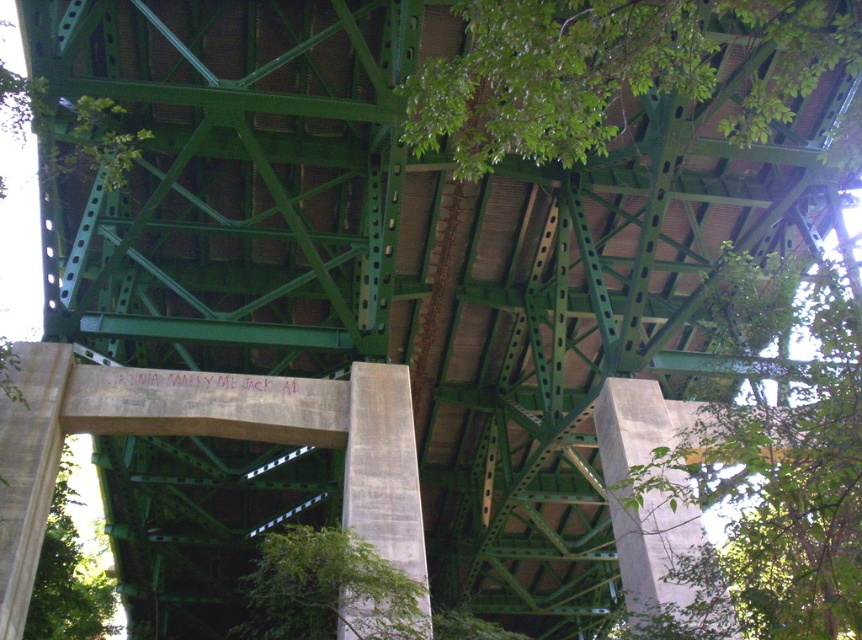
Looking at the green leafy tree at upper right and the green leafy tree at lower left in the bridge scene, which one is wider?

The green leafy tree at upper right is wider than the green leafy tree at lower left.

You are standing under the bridge and looking up. You notice two green leafy trees in the scene. Which tree is closer to you, the green leafy tree at upper right or the green leafy tree at lower left?

The green leafy tree at upper right is closer to you because it is in front of the green leafy tree at lower left.

Looking up at the underside of the green steel truss bridge, you notice two green leafy trees in the scene. Which tree, the green leafy tree at center or the green leafy tree at upper right, appears taller?

The green leafy tree at upper right appears taller than the green leafy tree at center.